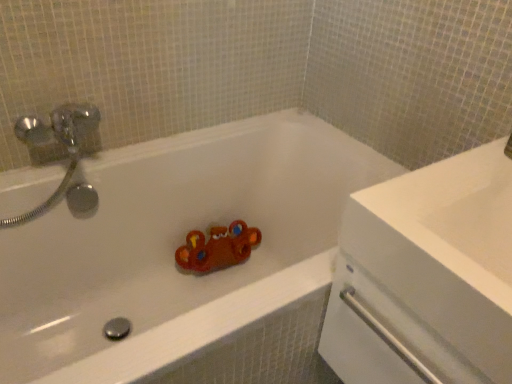
Question: Considering the relative positions of white glossy bathtub at center and white glossy sink at upper right in the image provided, is white glossy bathtub at center to the left or to the right of white glossy sink at upper right?

Choices:
 (A) right
 (B) left

Answer: (B)

Question: In terms of size, does white glossy bathtub at center appear bigger or smaller than white glossy sink at upper right?

Choices:
 (A) big
 (B) small

Answer: (A)

Question: From a real-world perspective, is white glossy bathtub at center positioned above or below white glossy sink at upper right?

Choices:
 (A) above
 (B) below

Answer: (B)

Question: From a real-world perspective, is white glossy sink at upper right physically located above or below white glossy bathtub at center?

Choices:
 (A) below
 (B) above

Answer: (B)

Question: Considering the positions of white glossy sink at upper right and white glossy bathtub at center in the image, is white glossy sink at upper right taller or shorter than white glossy bathtub at center?

Choices:
 (A) short
 (B) tall

Answer: (A)

Question: From the image's perspective, is white glossy sink at upper right positioned above or below white glossy bathtub at center?

Choices:
 (A) below
 (B) above

Answer: (B)

Question: Is white glossy sink at upper right inside or outside of white glossy bathtub at center?

Choices:
 (A) inside
 (B) outside

Answer: (B)